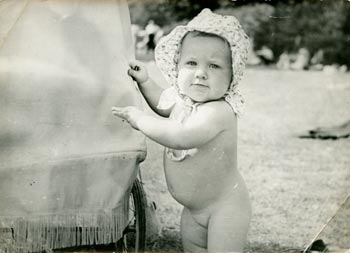
Where is `fabric`? The width and height of the screenshot is (350, 253). fabric is located at coordinates (60, 120).